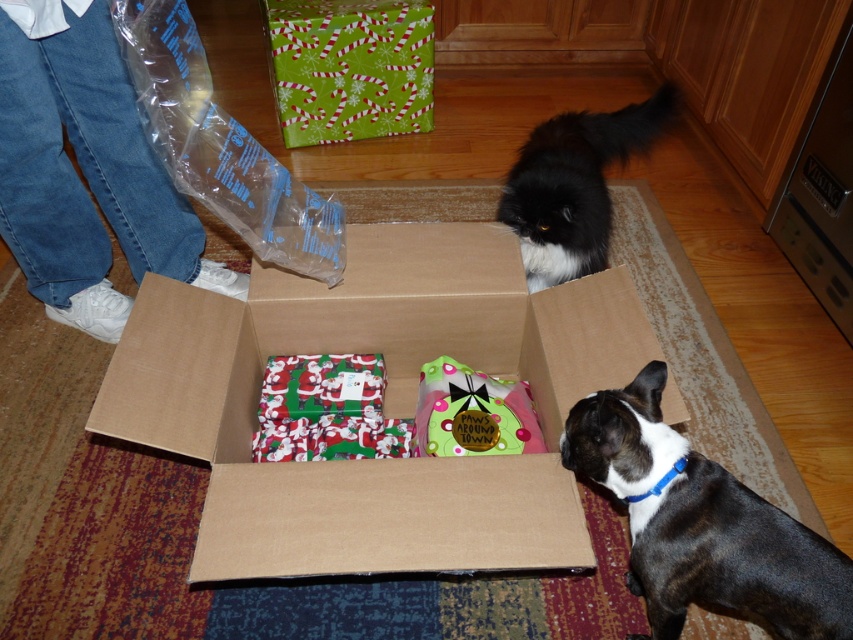
You are standing at the center of the room and want to pick up the black smooth dog at lower right. Which direction should you move to reach it?

The black smooth dog at lower right is located at point (701, 524), so you should move towards the lower right direction to reach it.

You are organizing a holiday gift wrapping station and need to ensure there is enough space for both the black fluffy cat at upper center and the santa claus wrapping paper at center. Given that the table you have is 1 meter wide, can both items fit side by side without overlapping?

The black fluffy cat at upper center is wider than the santa claus wrapping paper at center. However, since the total width of both items combined is not provided, it is impossible to determine if they can fit on a 1 meter wide table without more information about their individual widths.